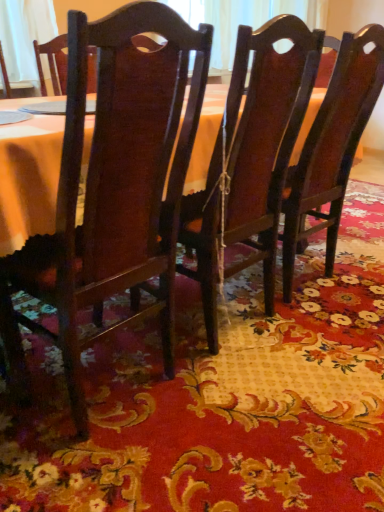
You are a GUI agent. You are given a task and a screenshot of the screen. Output one action in this format:
    pyautogui.click(x=<x>, y=<y>)
    Task: Click on the dark wood chair at center, which ranks as the 2th chair in right-to-left order
    This screenshot has height=512, width=384.
    Given the screenshot: What is the action you would take?
    265,134

This screenshot has width=384, height=512. What do you see at coordinates (265, 134) in the screenshot? I see `dark wood chair at center, which is counted as the 2th chair, starting from the left` at bounding box center [265, 134].

What is the approximate width of matte wood chair at center, arranged as the third chair when viewed from the right?

16.55 inches.

Image resolution: width=384 pixels, height=512 pixels. Describe the element at coordinates (332, 147) in the screenshot. I see `glossy wood chair at center, the first chair in the right-to-left sequence` at that location.

The height and width of the screenshot is (512, 384). I want to click on dark wood chair at center, which is counted as the 2th chair, starting from the left, so click(265, 134).

Where is `place mat that is in front of the glossy wood chair at center, which is counted as the third chair, starting from the left`? place mat that is in front of the glossy wood chair at center, which is counted as the third chair, starting from the left is located at coordinates (223, 399).

Does glossy wood chair at center, which is counted as the third chair, starting from the left, have a lesser width compared to floral-patterned fabric at center?

Yes.

From the image's perspective, which object appears higher, glossy wood chair at center, the first chair in the right-to-left sequence, or floral-patterned fabric at center?

From the image's view, glossy wood chair at center, the first chair in the right-to-left sequence, is above.

Does glossy wood chair at center, the first chair in the right-to-left sequence, appear on the left side of floral-patterned fabric at center?

Correct, you'll find glossy wood chair at center, the first chair in the right-to-left sequence, to the left of floral-patterned fabric at center.

Which object is closer to the camera taking this photo, floral-patterned fabric at center or glossy wood chair at center, which is counted as the third chair, starting from the left?

floral-patterned fabric at center is more forward.

Is glossy wood chair at center, the first chair in the right-to-left sequence, at the back of floral-patterned fabric at center?

Correct, floral-patterned fabric at center is looking away from glossy wood chair at center, the first chair in the right-to-left sequence.

Which is correct: floral-patterned fabric at center is inside glossy wood chair at center, which is counted as the third chair, starting from the left, or outside of it?

floral-patterned fabric at center is outside glossy wood chair at center, which is counted as the third chair, starting from the left.

Who is taller, floral-patterned fabric at center or glossy wood chair at center, the first chair in the right-to-left sequence?

glossy wood chair at center, the first chair in the right-to-left sequence, is taller.

Considering the positions of point (294, 116) and point (328, 176), is point (294, 116) closer or farther from the camera than point (328, 176)?

Point (294, 116).

From a real-world perspective, is dark wood chair at center, which is counted as the 2th chair, starting from the left, physically located above or below glossy wood chair at center, which is counted as the third chair, starting from the left?

In terms of real-world spatial position, dark wood chair at center, which is counted as the 2th chair, starting from the left, is below glossy wood chair at center, which is counted as the third chair, starting from the left.

Considering the relative positions of dark wood chair at center, which is counted as the 2th chair, starting from the left, and glossy wood chair at center, the first chair in the right-to-left sequence, in the image provided, is dark wood chair at center, which is counted as the 2th chair, starting from the left, to the right of glossy wood chair at center, the first chair in the right-to-left sequence, from the viewer's perspective?

No.

Consider the image. Which is more to the right, glossy wood chair at center, which is counted as the third chair, starting from the left, or dark wood chair at center, which ranks as the 2th chair in right-to-left order?

glossy wood chair at center, which is counted as the third chair, starting from the left, is more to the right.

How different are the orientations of glossy wood chair at center, which is counted as the third chair, starting from the left, and dark wood chair at center, which ranks as the 2th chair in right-to-left order, in degrees?

0.000327 degrees separate the facing orientations of glossy wood chair at center, which is counted as the third chair, starting from the left, and dark wood chair at center, which ranks as the 2th chair in right-to-left order.

In the image, is glossy wood chair at center, which is counted as the third chair, starting from the left, positioned in front of or behind dark wood chair at center, which ranks as the 2th chair in right-to-left order?

Visually, glossy wood chair at center, which is counted as the third chair, starting from the left, is located behind dark wood chair at center, which ranks as the 2th chair in right-to-left order.

Which is behind, point (337, 89) or point (245, 164)?

Point (337, 89)

From a real-world perspective, is glossy wood chair at center, which is counted as the third chair, starting from the left, beneath matte wood chair at center, arranged as the third chair when viewed from the right?

Actually, glossy wood chair at center, which is counted as the third chair, starting from the left, is physically above matte wood chair at center, arranged as the third chair when viewed from the right, in the real world.

Considering the sizes of objects glossy wood chair at center, the first chair in the right-to-left sequence, and matte wood chair at center, which ranks as the 1th chair in left-to-right order, in the image provided, who is thinner, glossy wood chair at center, the first chair in the right-to-left sequence, or matte wood chair at center, which ranks as the 1th chair in left-to-right order,?

With smaller width is matte wood chair at center, which ranks as the 1th chair in left-to-right order.

Considering the sizes of objects matte wood chair at center, arranged as the third chair when viewed from the right, and floral-patterned fabric at center in the image provided, who is shorter, matte wood chair at center, arranged as the third chair when viewed from the right, or floral-patterned fabric at center?

Standing shorter between the two is floral-patterned fabric at center.

Can we say matte wood chair at center, which ranks as the 1th chair in left-to-right order, lies outside floral-patterned fabric at center?

Indeed, matte wood chair at center, which ranks as the 1th chair in left-to-right order, is completely outside floral-patterned fabric at center.

What's the angular difference between matte wood chair at center, arranged as the third chair when viewed from the right, and floral-patterned fabric at center's facing directions?

179 degrees separate the facing orientations of matte wood chair at center, arranged as the third chair when viewed from the right, and floral-patterned fabric at center.

How far apart are matte wood chair at center, which ranks as the 1th chair in left-to-right order, and floral-patterned fabric at center?

matte wood chair at center, which ranks as the 1th chair in left-to-right order, is 36.39 centimeters away from floral-patterned fabric at center.

From the image's perspective, starting from the matte wood chair at center, which ranks as the 1th chair in left-to-right order, which chair is the 1st one above? Please provide its 2D coordinates.

[(265, 134)]

Which is behind, point (271, 270) or point (98, 135)?

Point (271, 270)

The height and width of the screenshot is (512, 384). Identify the location of place mat located on the right of glossy wood chair at center, which is counted as the third chair, starting from the left. (223, 399).

You are a GUI agent. You are given a task and a screenshot of the screen. Output one action in this format:
    pyautogui.click(x=<x>, y=<y>)
    Task: Click on the place mat below the glossy wood chair at center, the first chair in the right-to-left sequence (from the image's perspective)
    The image size is (384, 512).
    Given the screenshot: What is the action you would take?
    pyautogui.click(x=223, y=399)

Considering their positions, is glossy wood chair at center, which is counted as the third chair, starting from the left, positioned further to floral-patterned fabric at center than matte wood chair at center, which ranks as the 1th chair in left-to-right order?

Based on the image, glossy wood chair at center, which is counted as the third chair, starting from the left, appears to be further to floral-patterned fabric at center.

From the image, which object appears to be nearer to floral-patterned fabric at center, dark wood chair at center, which is counted as the 2th chair, starting from the left, or matte wood chair at center, arranged as the third chair when viewed from the right?

The object closer to floral-patterned fabric at center is dark wood chair at center, which is counted as the 2th chair, starting from the left.

Based on their spatial positions, is dark wood chair at center, which ranks as the 2th chair in right-to-left order, or floral-patterned fabric at center closer to glossy wood chair at center, the first chair in the right-to-left sequence?

dark wood chair at center, which ranks as the 2th chair in right-to-left order.

Looking at this image, considering their positions, is dark wood chair at center, which is counted as the 2th chair, starting from the left, positioned closer to matte wood chair at center, arranged as the third chair when viewed from the right, than glossy wood chair at center, which is counted as the third chair, starting from the left?

dark wood chair at center, which is counted as the 2th chair, starting from the left, is positioned closer to the anchor matte wood chair at center, arranged as the third chair when viewed from the right.

Looking at the image, which one is located further to dark wood chair at center, which is counted as the 2th chair, starting from the left, glossy wood chair at center, which is counted as the third chair, starting from the left, or floral-patterned fabric at center?

The object further to dark wood chair at center, which is counted as the 2th chair, starting from the left, is floral-patterned fabric at center.

Consider the image. Based on their spatial positions, is matte wood chair at center, which ranks as the 1th chair in left-to-right order, or floral-patterned fabric at center closer to dark wood chair at center, which ranks as the 2th chair in right-to-left order?

The object closer to dark wood chair at center, which ranks as the 2th chair in right-to-left order, is matte wood chair at center, which ranks as the 1th chair in left-to-right order.

Based on their spatial positions, is dark wood chair at center, which ranks as the 2th chair in right-to-left order, or floral-patterned fabric at center closer to matte wood chair at center, which ranks as the 1th chair in left-to-right order?

Among the two, dark wood chair at center, which ranks as the 2th chair in right-to-left order, is located nearer to matte wood chair at center, which ranks as the 1th chair in left-to-right order.

Considering their positions, is glossy wood chair at center, which is counted as the third chair, starting from the left, positioned further to dark wood chair at center, which is counted as the 2th chair, starting from the left, than matte wood chair at center, arranged as the third chair when viewed from the right?

Based on the image, matte wood chair at center, arranged as the third chair when viewed from the right, appears to be further to dark wood chair at center, which is counted as the 2th chair, starting from the left.

Image resolution: width=384 pixels, height=512 pixels. What are the coordinates of `chair between matte wood chair at center, which ranks as the 1th chair in left-to-right order, and glossy wood chair at center, the first chair in the right-to-left sequence, from left to right` in the screenshot? It's located at (265, 134).